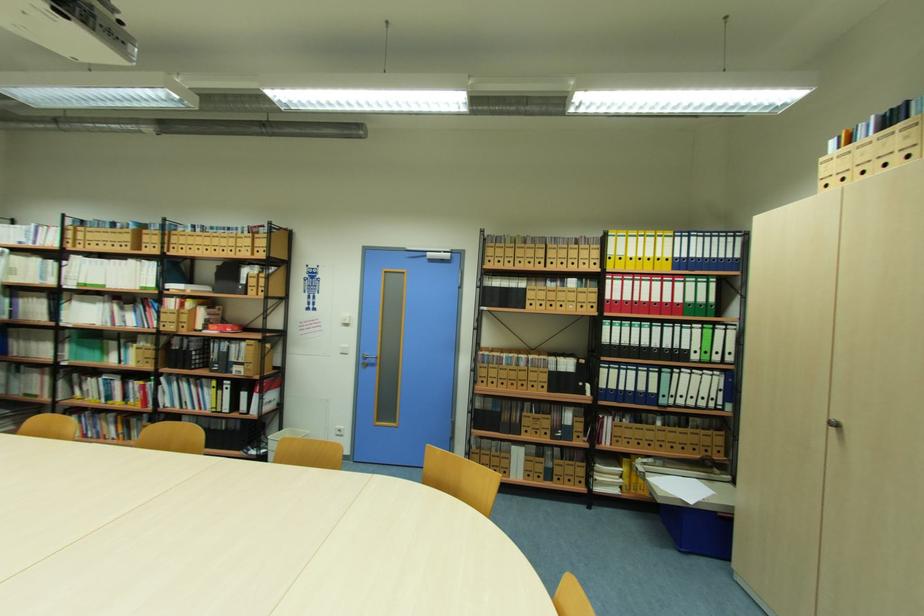
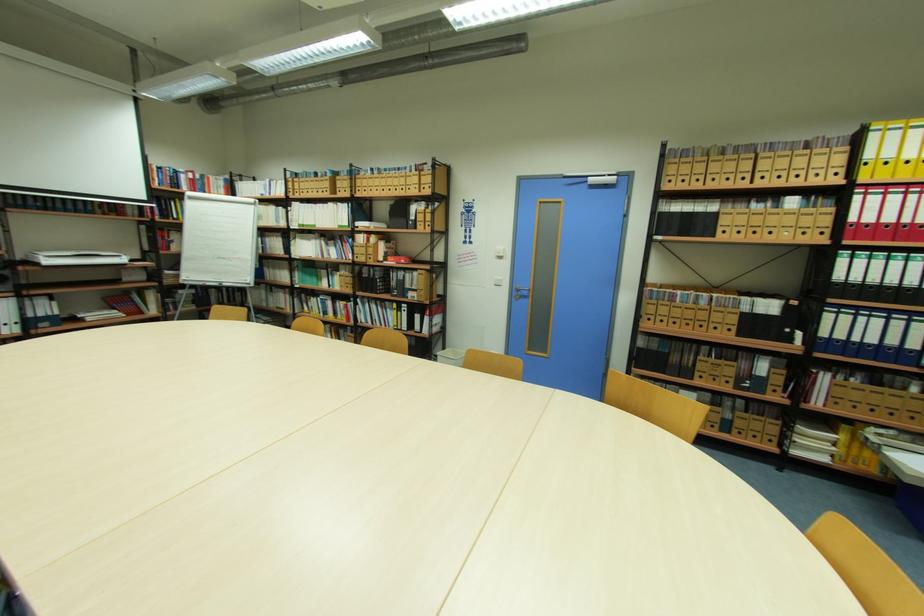
Question: How did the camera likely rotate?

Choices:
 (A) Left
 (B) Right
 (C) Up
 (D) Down

Answer: (A)